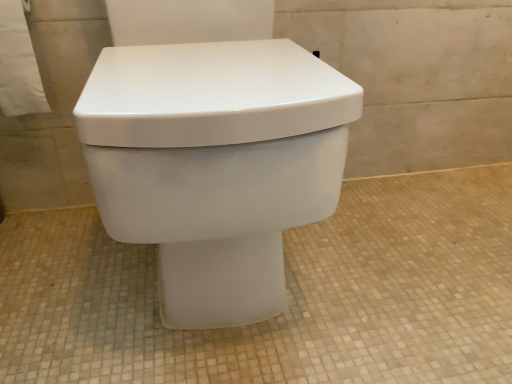
Find the location of a particular element. This screenshot has width=512, height=384. vacant space that is to the left of white glossy toilet at center is located at coordinates (64, 270).